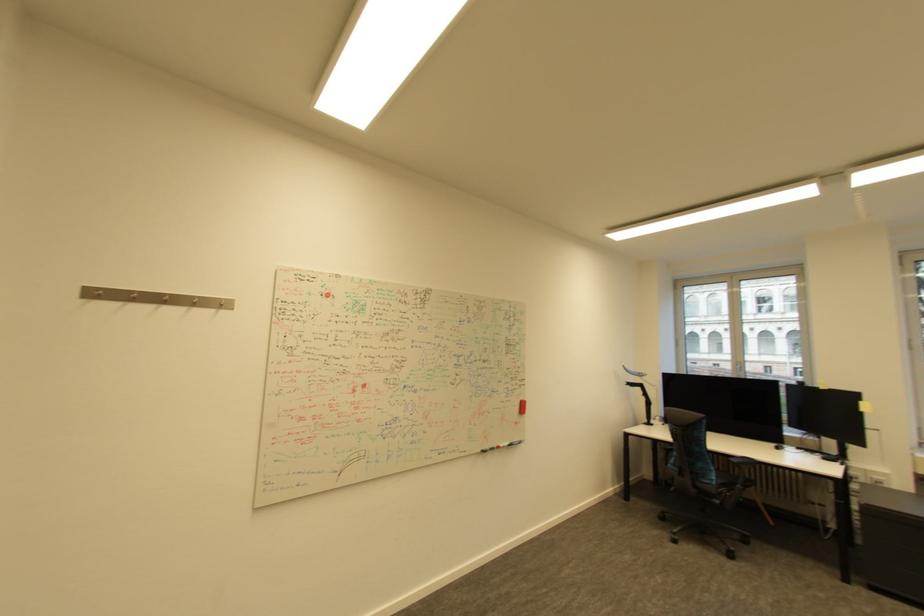
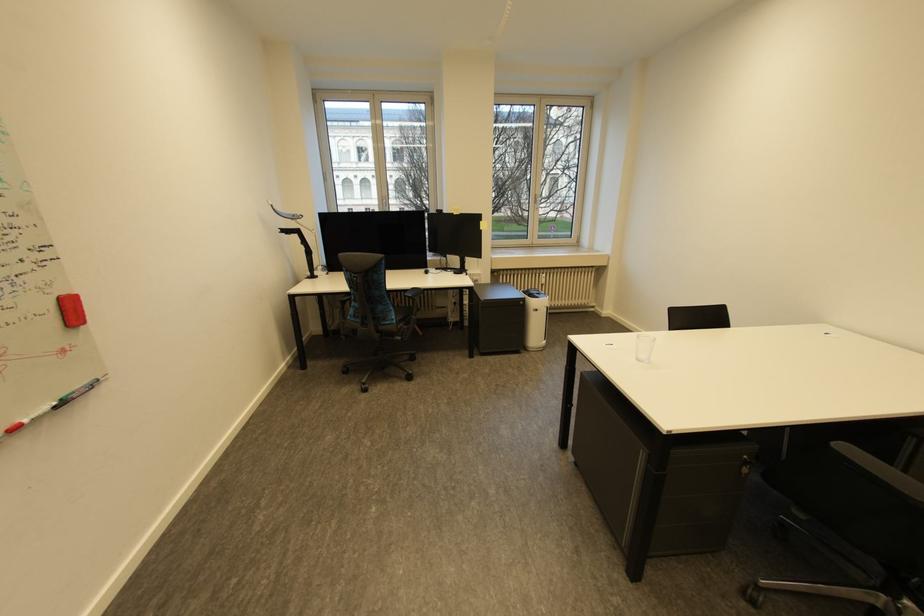
The point at (x=736, y=374) is marked in the first image. Where is the corresponding point in the second image?

(383, 209)